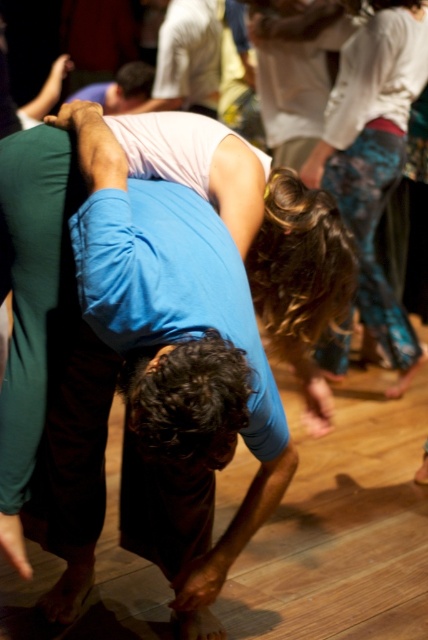
Question: Estimate the real-world distances between objects in this image. Which object is closer to the white matte shirt at upper center?

Choices:
 (A) white cotton shirt at upper center
 (B) blue tie-dye pants at right
 (C) blue cotton shirt at center

Answer: (A)

Question: Can you confirm if blue tie-dye pants at right is bigger than white cotton shirt at upper center?

Choices:
 (A) yes
 (B) no

Answer: (B)

Question: Can you confirm if white cotton shirt at upper center is positioned above matte white shirt at upper center?

Choices:
 (A) no
 (B) yes

Answer: (B)

Question: Which point is farther to the camera?

Choices:
 (A) blue cotton shirt at center
 (B) blue tie-dye pants at right
 (C) matte white shirt at upper center
 (D) white matte shirt at upper center

Answer: (C)

Question: Is blue cotton shirt at center positioned behind white matte shirt at upper center?

Choices:
 (A) no
 (B) yes

Answer: (A)

Question: Which of the following is the closest to the observer?

Choices:
 (A) blue tie-dye pants at right
 (B) white matte shirt at upper center
 (C) matte white shirt at upper center

Answer: (A)